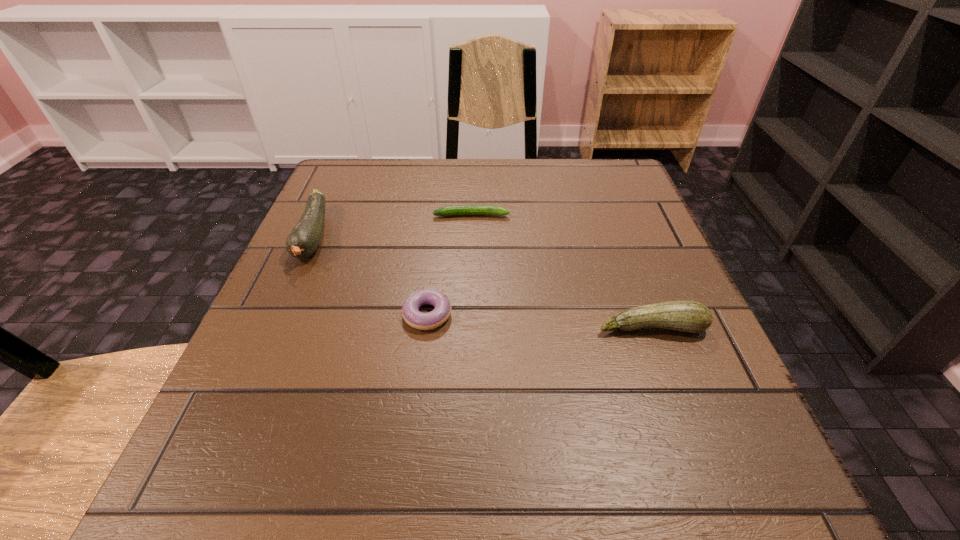
The height and width of the screenshot is (540, 960). What are the coordinates of `zucchini that is the second closest to the rightmost zucchini` in the screenshot? It's located at (304, 239).

The image size is (960, 540). What are the coordinates of `the second closest zucchini to the shortest object` in the screenshot? It's located at (686, 316).

Locate an element on the screen. free space that satisfies the following two spatial constraints: 1. on the front-facing side of the shortest zucchini; 2. at the blossom end of the leftmost zucchini is located at coordinates (470, 236).

The width and height of the screenshot is (960, 540). Find the location of `vacant space that satisfies the following two spatial constraints: 1. at the blossom end of the leftmost zucchini; 2. on the left side of the second shortest object`. vacant space that satisfies the following two spatial constraints: 1. at the blossom end of the leftmost zucchini; 2. on the left side of the second shortest object is located at coordinates (279, 314).